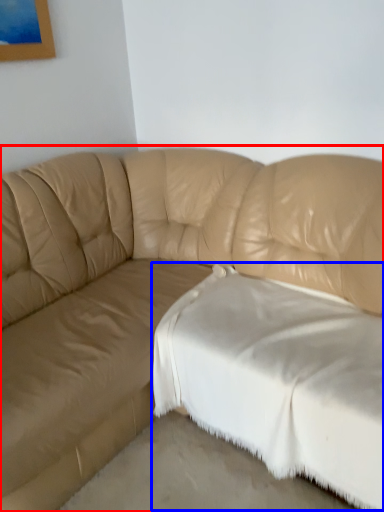
Question: Which point is further to the camera, studio couch (highlighted by a red box) or sheet (highlighted by a blue box)?

Choices:
 (A) studio couch
 (B) sheet

Answer: (B)